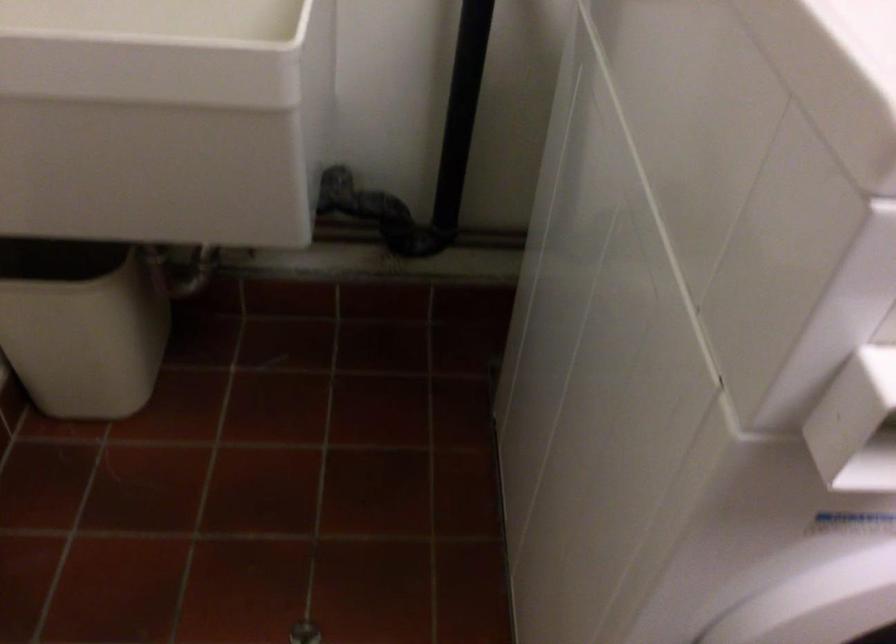
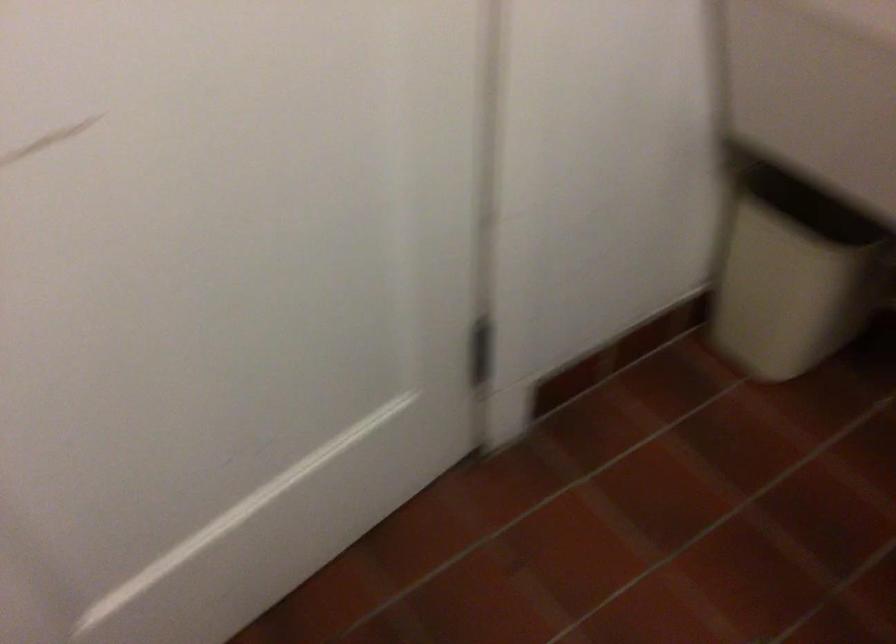
The point at (75,326) is marked in the first image. Where is the corresponding point in the second image?

(794, 272)